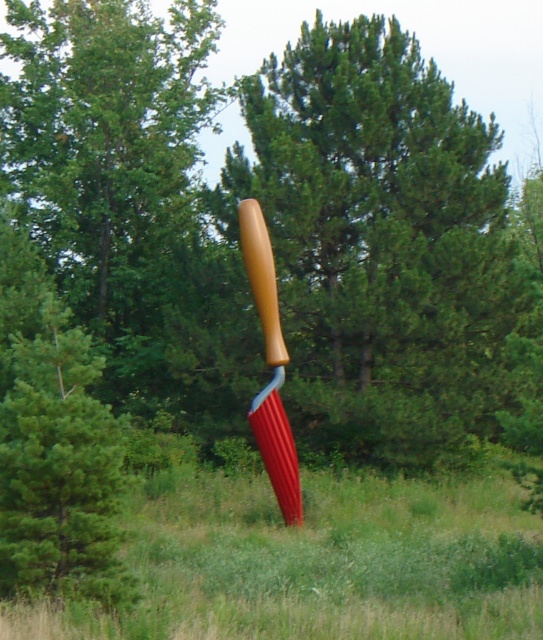
You are an artist planning to paint the sculpture and the baseball bat. You want to ensure that the smooth brown handle at center and the wooden handle baseball bat at center are positioned correctly in your painting. Based on the scene, which object should be placed higher in your artwork?

Result: The smooth brown handle at center should be placed higher in the artwork since it is located above the wooden handle baseball bat at center in the scene.

You are standing at the base of the sculpture and want to grab both the smooth brown handle at center and the wooden handle baseball bat at center. Can you reach both items without moving your feet?

The smooth brown handle at center is 3.83 meters away from wooden handle baseball bat at center. Since the distance between them is greater than an average person can reach, you cannot grab both items without moving your feet.